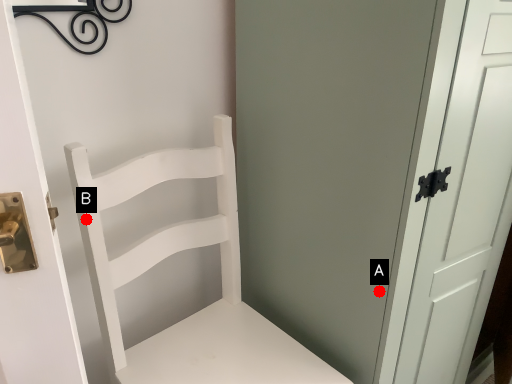
Question: Two points are circled on the image, labeled by A and B beside each circle. Among these points, which one is nearest to the camera?

Choices:
 (A) A is closer
 (B) B is closer

Answer: (B)